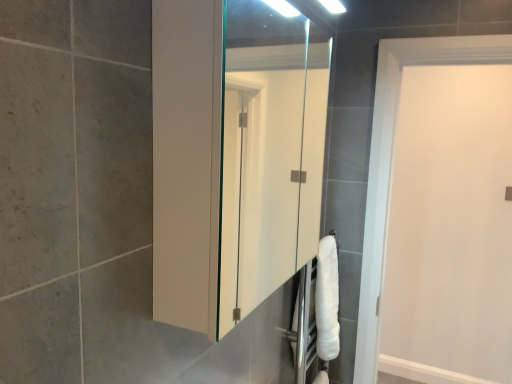
Question: Is the position of white glossy cabinet at center less distant than that of white matte door at right?

Choices:
 (A) no
 (B) yes

Answer: (B)

Question: Could you tell me if white glossy cabinet at center is facing white matte door at right?

Choices:
 (A) yes
 (B) no

Answer: (B)

Question: Can you confirm if white glossy cabinet at center is thinner than white matte door at right?

Choices:
 (A) yes
 (B) no

Answer: (B)

Question: Is white glossy cabinet at center wider than white matte door at right?

Choices:
 (A) no
 (B) yes

Answer: (B)

Question: From a real-world perspective, does white glossy cabinet at center stand above white matte door at right?

Choices:
 (A) yes
 (B) no

Answer: (A)

Question: Considering the relative sizes of white glossy cabinet at center and white matte door at right in the image provided, is white glossy cabinet at center bigger than white matte door at right?

Choices:
 (A) no
 (B) yes

Answer: (A)

Question: Would you say white glossy cabinet at center is part of white matte door at right's contents?

Choices:
 (A) yes
 (B) no

Answer: (B)

Question: Does white matte door at right have a lesser width compared to white glossy cabinet at center?

Choices:
 (A) yes
 (B) no

Answer: (A)

Question: Is white matte door at right positioned beyond the bounds of white glossy cabinet at center?

Choices:
 (A) yes
 (B) no

Answer: (A)

Question: From a real-world perspective, does white matte door at right stand above white glossy cabinet at center?

Choices:
 (A) no
 (B) yes

Answer: (A)

Question: Is the position of white matte door at right more distant than that of white glossy cabinet at center?

Choices:
 (A) yes
 (B) no

Answer: (A)

Question: Is white matte door at right at the right side of white glossy cabinet at center?

Choices:
 (A) no
 (B) yes

Answer: (B)

Question: Does point (448, 168) appear closer or farther from the camera than point (242, 157)?

Choices:
 (A) farther
 (B) closer

Answer: (B)